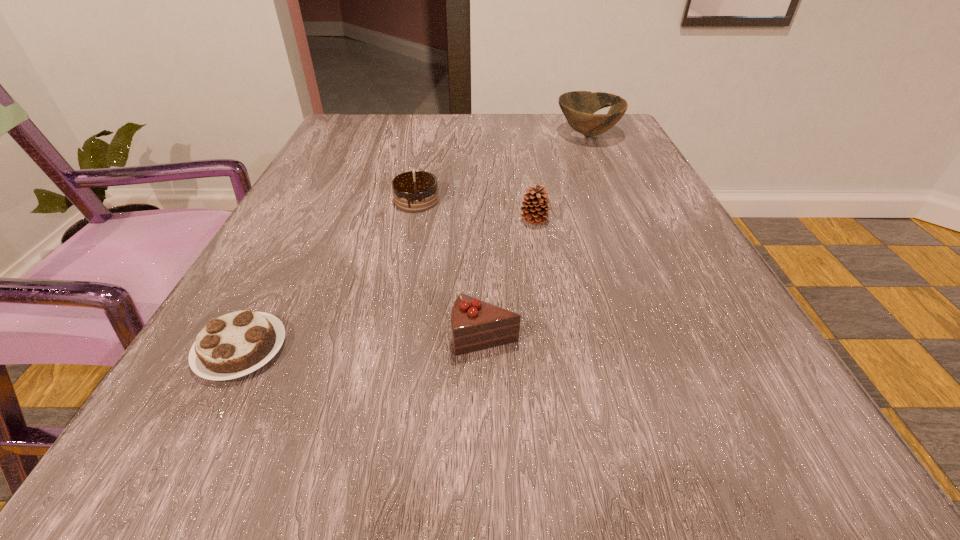
Locate an element on the screen. This screenshot has height=540, width=960. free spot at the left edge of the desktop is located at coordinates (292, 197).

You are a GUI agent. You are given a task and a screenshot of the screen. Output one action in this format:
    pyautogui.click(x=<x>, y=<y>)
    Task: Click on the free spot at the right edge of the desktop
    The width and height of the screenshot is (960, 540).
    Given the screenshot: What is the action you would take?
    pyautogui.click(x=678, y=310)

Find the location of a particular element. Image resolution: width=960 pixels, height=540 pixels. vacant space at the far right corner is located at coordinates (617, 139).

The image size is (960, 540). Identify the location of free space at the near right corner. (789, 431).

The image size is (960, 540). In order to click on vacant point located between the pinecone and the farthest object in this screenshot , I will do `click(561, 178)`.

Find the location of a particular element. vacant area that lies between the pinecone and the shortest object is located at coordinates (388, 285).

In order to click on free space between the third object from left to right and the pinecone in this screenshot , I will do `click(510, 279)`.

You are a GUI agent. You are given a task and a screenshot of the screen. Output one action in this format:
    pyautogui.click(x=<x>, y=<y>)
    Task: Click on the free space between the rightmost object and the fourth object from right to left
    
    Given the screenshot: What is the action you would take?
    pyautogui.click(x=502, y=167)

The image size is (960, 540). I want to click on vacant point located between the shortest object and the bowl, so click(415, 241).

Locate an element on the screen. vacant space that is in between the third nearest object and the fourth nearest object is located at coordinates (475, 211).